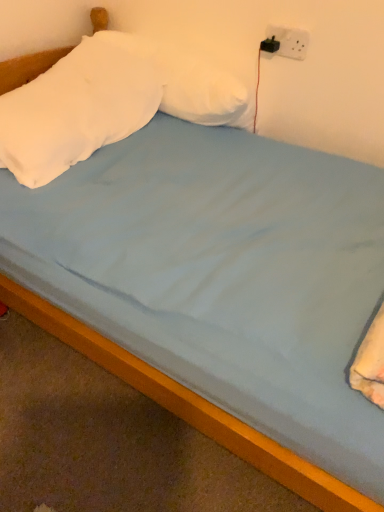
Identify the location of blank space situated above wooden bed frame at lower center (from a real-world perspective). (87, 432).